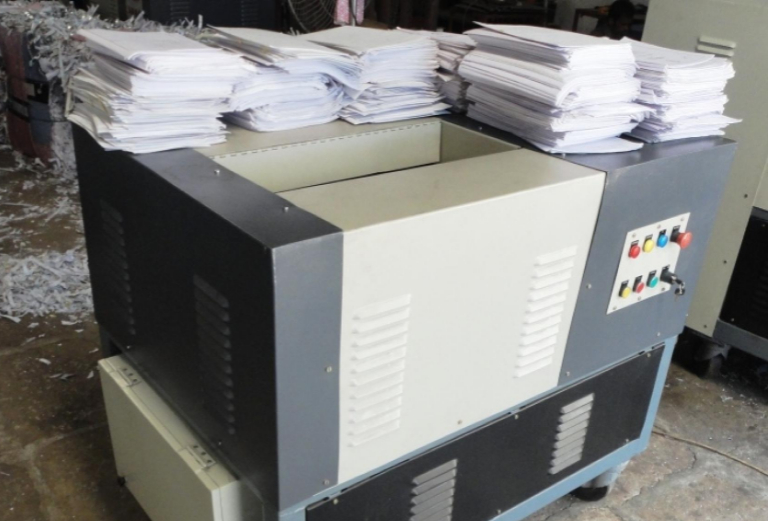
In order to click on paper shredder in this screenshot , I will do `click(458, 264)`.